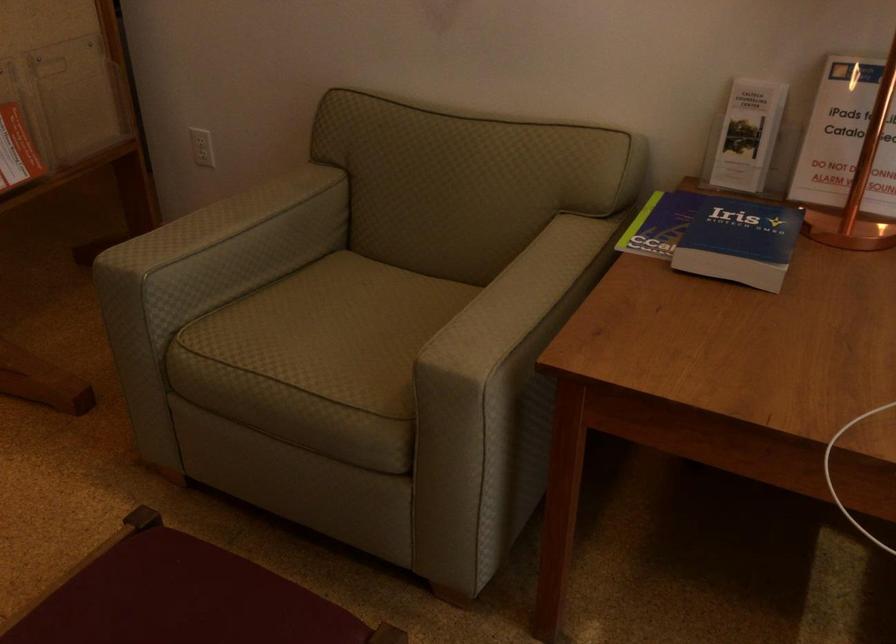
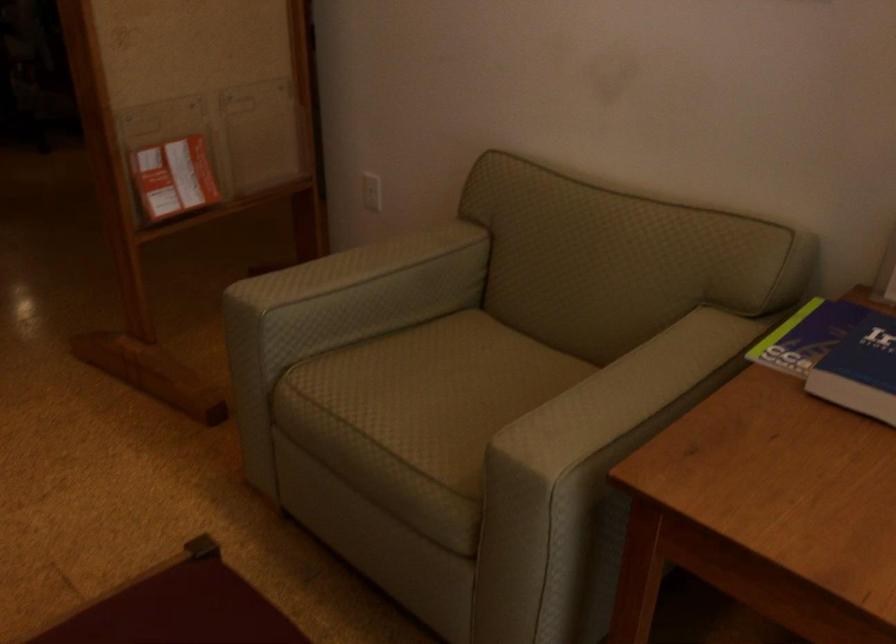
Question: How did the camera likely rotate?

Choices:
 (A) Left
 (B) Right
 (C) Up
 (D) Down

Answer: (A)